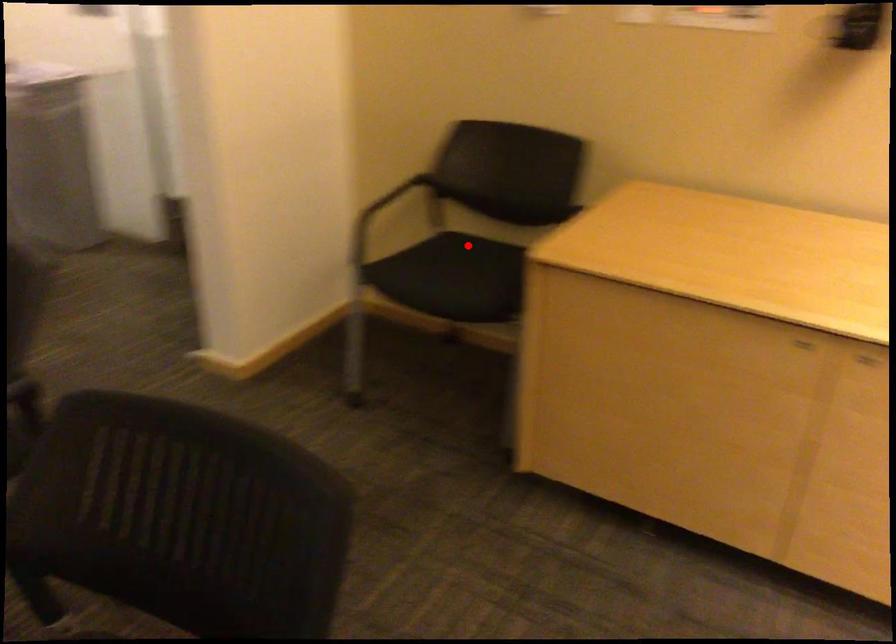
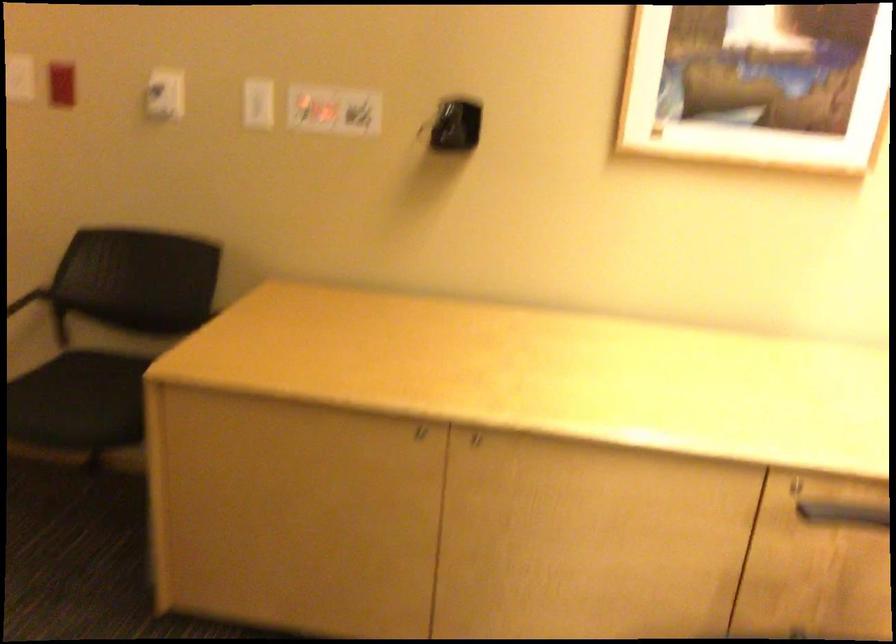
Find the pixel in the second image that matches the highlighted location in the first image.

(101, 373)